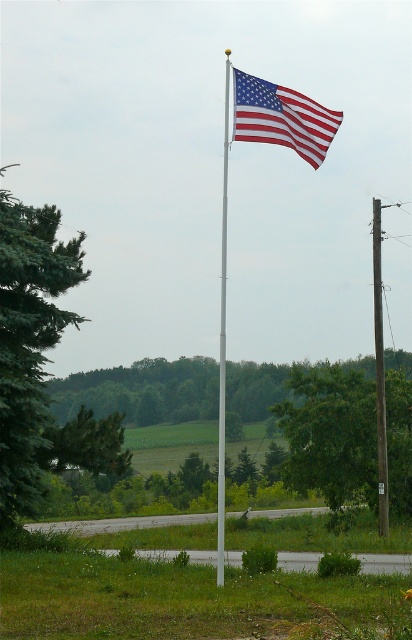
Question: Which object is closer to the camera taking this photo?

Choices:
 (A) metallic silver flag pole at center
 (B) green coniferous tree at left

Answer: (A)

Question: Which of these objects is positioned closest to the red/white striped fabric flag at upper center?

Choices:
 (A) green leafy tree at center
 (B) metallic silver flag pole at center
 (C) green coniferous tree at left
 (D) smooth gray pole at center

Answer: (C)

Question: Which point is farther to the camera?

Choices:
 (A) (320, 141)
 (B) (220, 340)
 (C) (376, 456)

Answer: (C)

Question: Does green leafy tree at center lie in front of smooth gray pole at center?

Choices:
 (A) yes
 (B) no

Answer: (B)

Question: Is the position of green leafy tree at center more distant than that of smooth gray pole at center?

Choices:
 (A) no
 (B) yes

Answer: (B)

Question: Is green coniferous tree at left closer to the viewer compared to smooth gray pole at center?

Choices:
 (A) no
 (B) yes

Answer: (B)